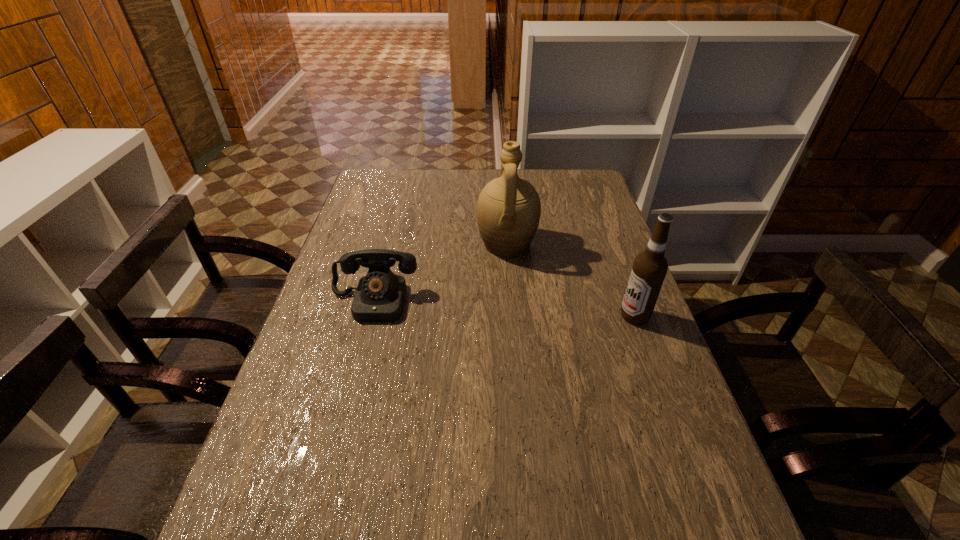
At what (x,y) coordinates should I click in order to perform the action: click on the farthest object. Please return your answer as a coordinate pair (x, y). Image resolution: width=960 pixels, height=540 pixels. Looking at the image, I should click on (508, 211).

Where is `the second object from left to right`? Image resolution: width=960 pixels, height=540 pixels. the second object from left to right is located at coordinates (508, 211).

Where is `the rightmost object`? the rightmost object is located at coordinates (649, 269).

This screenshot has width=960, height=540. In order to click on the shortest object in this screenshot , I will do `click(379, 297)`.

The width and height of the screenshot is (960, 540). I want to click on the leftmost object, so click(x=379, y=297).

Where is `free spot located on the back of the farthest object`? The width and height of the screenshot is (960, 540). free spot located on the back of the farthest object is located at coordinates (503, 194).

You are a GUI agent. You are given a task and a screenshot of the screen. Output one action in this format:
    pyautogui.click(x=<x>, y=<y>)
    Task: Click on the vacant space located on the label of the rightmost object
    Image resolution: width=960 pixels, height=540 pixels.
    Given the screenshot: What is the action you would take?
    coord(571,316)

In order to click on free space located 0.250m on the label of the rightmost object in this screenshot , I will do tap(527, 316).

Locate an element on the screen. This screenshot has height=540, width=960. free space located on the label of the rightmost object is located at coordinates point(497,316).

Identify the location of free region located on the dial of the shortest object. (357, 365).